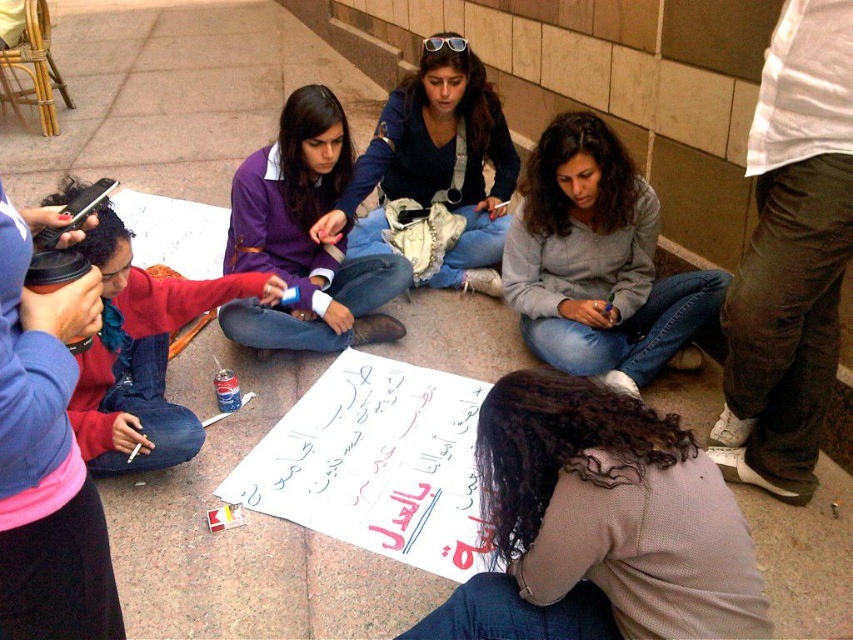
Question: Can you confirm if light brown sweater at lower center is wider than gray matte sweater at center?

Choices:
 (A) yes
 (B) no

Answer: (B)

Question: Is purple fabric shirt at upper center further to the viewer compared to blue denim jeans at center?

Choices:
 (A) no
 (B) yes

Answer: (A)

Question: Which object appears farthest from the camera in this image?

Choices:
 (A) matte red sweater at lower left
 (B) purple fabric shirt at upper center
 (C) blue denim jeans at center

Answer: (C)

Question: From the image, what is the correct spatial relationship of light brown sweater at lower center in relation to purple fabric shirt at upper center?

Choices:
 (A) right
 (B) left

Answer: (A)

Question: Which object is positioned closest to the purple fabric shirt at upper center?

Choices:
 (A) light brown sweater at lower center
 (B) matte red sweater at lower left

Answer: (B)

Question: Which of these objects is positioned closest to the purple fabric shirt at upper center?

Choices:
 (A) gray matte sweater at center
 (B) light brown sweater at lower center

Answer: (A)